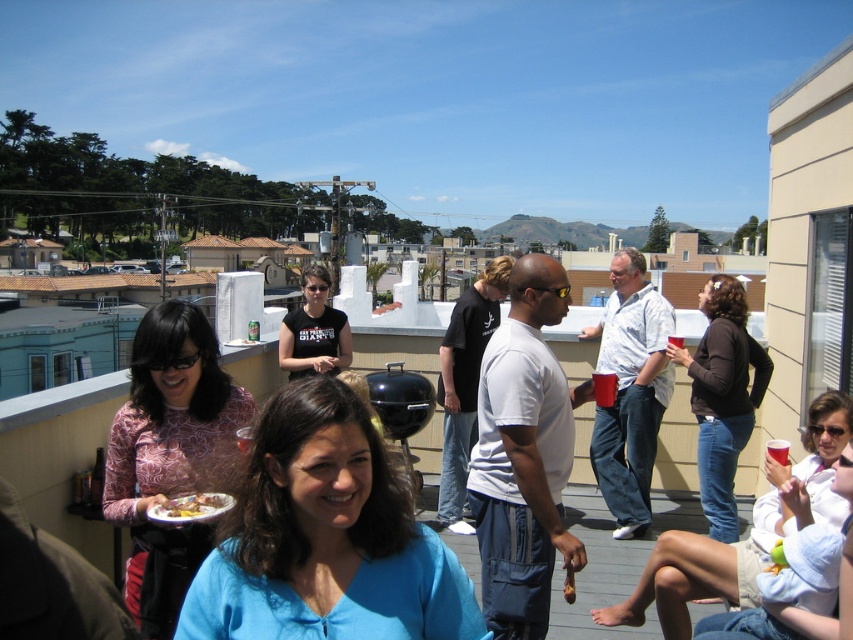
Can you confirm if dark brown sweater at center is positioned below golden brown bread at lower left?

Yes.

Is dark brown sweater at center bigger than golden brown bread at lower left?

Yes.

What do you see at coordinates (722, 396) in the screenshot? The width and height of the screenshot is (853, 640). I see `dark brown sweater at center` at bounding box center [722, 396].

Identify the location of dark brown sweater at center. (722, 396).

Can you confirm if blue matte shirt at center is bigger than black t-shirt at center?

No, blue matte shirt at center is not bigger than black t-shirt at center.

Does blue matte shirt at center appear over black t-shirt at center?

No, blue matte shirt at center is not above black t-shirt at center.

Is point (380, 566) positioned before point (329, 339)?

Yes, point (380, 566) is closer to viewer.

Locate an element on the screen. Image resolution: width=853 pixels, height=640 pixels. blue matte shirt at center is located at coordinates (325, 538).

Between blue matte shirt at center and light brown fabric shorts at lower right, which one is positioned lower?

Positioned lower is light brown fabric shorts at lower right.

Who is positioned more to the left, blue matte shirt at center or light brown fabric shorts at lower right?

blue matte shirt at center is more to the left.

Locate an element on the screen. blue matte shirt at center is located at coordinates (325, 538).